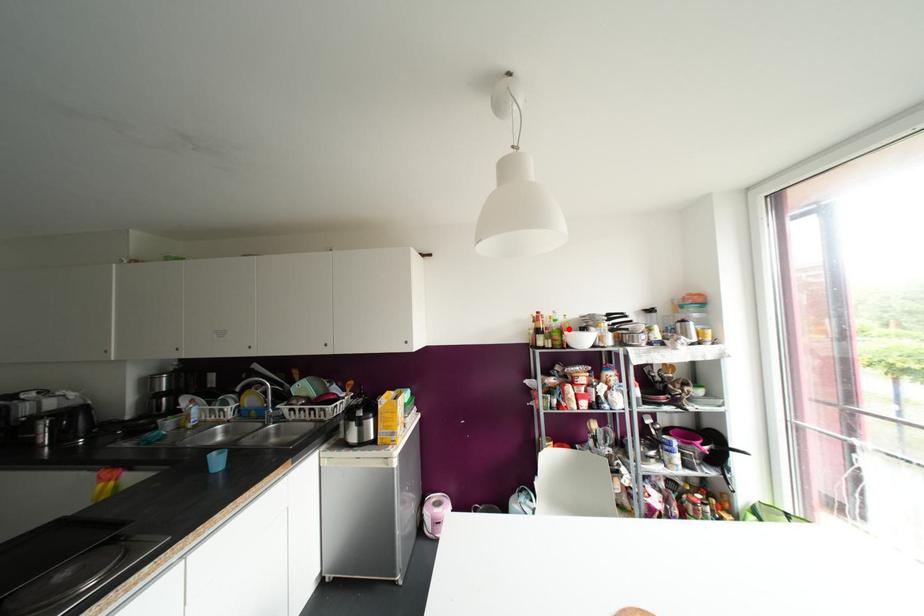
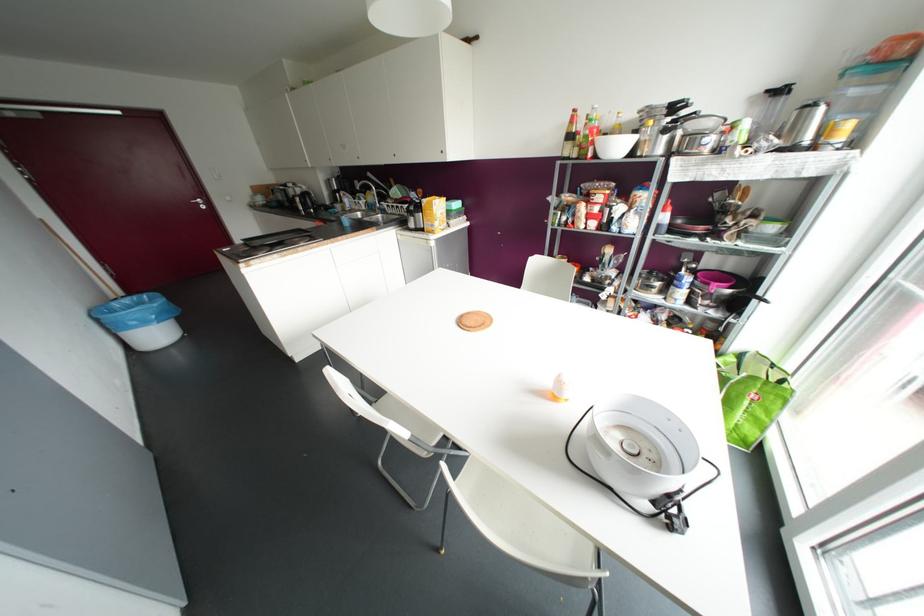
Question: I am providing you with two images of the same scene from different viewpoints. A red point is marked on the first image. Is the red point's position out of view in image 2?

Choices:
 (A) Yes
 (B) No

Answer: (B)